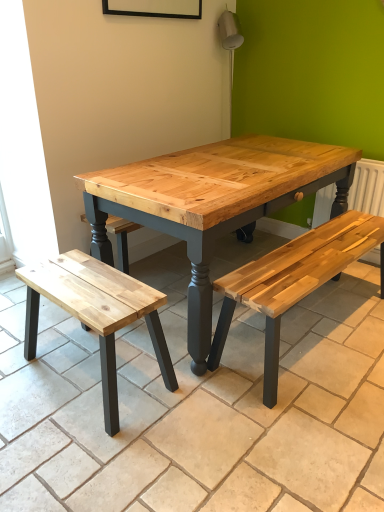
At what (x,y) coordinates should I click in order to perform the action: click on vacant space underneath natural wood bench at lower left (from a real-world perspective). Please return your answer as a coordinate pair (x, y). Image resolution: width=384 pixels, height=512 pixels. Looking at the image, I should click on (96, 368).